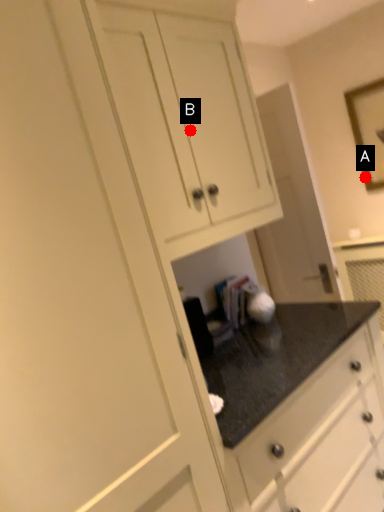
Question: Two points are circled on the image, labeled by A and B beside each circle. Which point appears farthest from the camera in this image?

Choices:
 (A) A is further
 (B) B is further

Answer: (A)